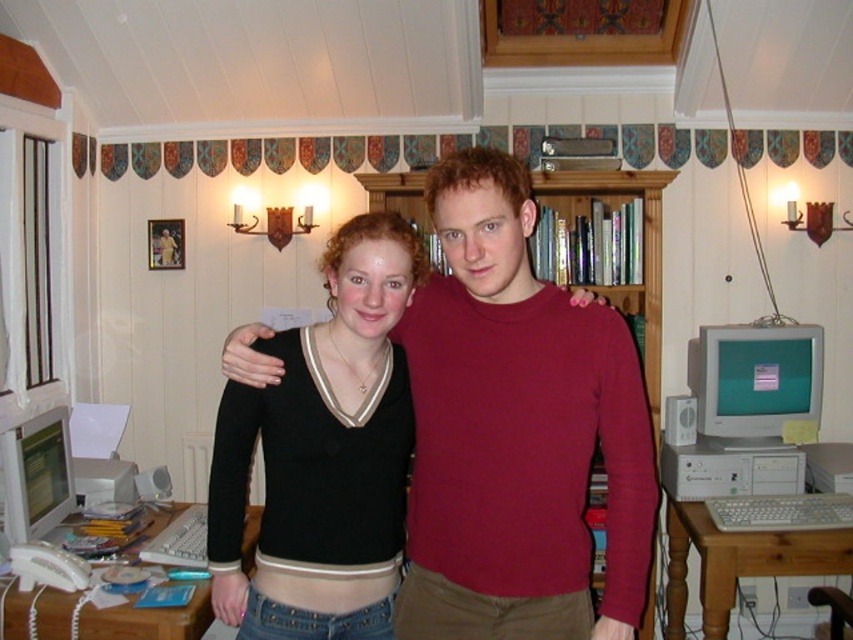
Does black jersey at center have a greater height compared to matte white monitor at lower left?

Yes.

Does black jersey at center have a lesser width compared to matte white monitor at lower left?

No.

Does point (339, 376) lie in front of point (18, 512)?

That is True.

Where is `black jersey at center`? Image resolution: width=853 pixels, height=640 pixels. black jersey at center is located at coordinates (323, 456).

Does matte silver monitor at right have a larger size compared to white plastic desktop computer at lower right?

Indeed, matte silver monitor at right has a larger size compared to white plastic desktop computer at lower right.

Is matte silver monitor at right wider than white plastic desktop computer at lower right?

Indeed, matte silver monitor at right has a greater width compared to white plastic desktop computer at lower right.

Does point (817, 348) lie behind point (672, 465)?

Yes, it is.

Identify the location of matte silver monitor at right. (756, 380).

Does wooden bookshelf at center have a larger size compared to matte white monitor at lower left?

Indeed, wooden bookshelf at center has a larger size compared to matte white monitor at lower left.

Can you confirm if wooden bookshelf at center is positioned to the right of matte white monitor at lower left?

Indeed, wooden bookshelf at center is positioned on the right side of matte white monitor at lower left.

Who is more distant from viewer, (669, 182) or (62, 465)?

The point (669, 182) is more distant.

At what (x,y) coordinates should I click in order to perform the action: click on wooden bookshelf at center. Please return your answer as a coordinate pair (x, y). The width and height of the screenshot is (853, 640). Looking at the image, I should click on (637, 244).